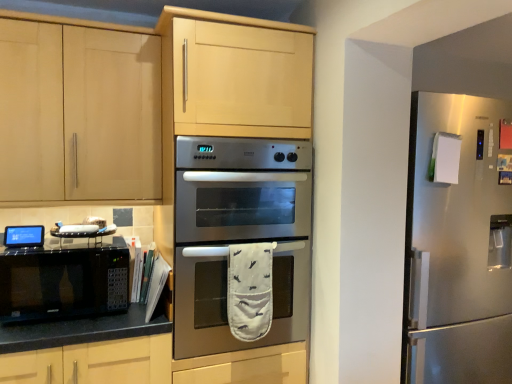
This screenshot has height=384, width=512. What do you see at coordinates (79, 113) in the screenshot?
I see `matte wood cabinet at upper left` at bounding box center [79, 113].

What is the approximate width of black matte microwave at left?

The width of black matte microwave at left is 2.90 inches.

Describe the element at coordinates (458, 242) in the screenshot. Image resolution: width=512 pixels, height=384 pixels. I see `satin silver refrigerator at right` at that location.

Locate an element on the screen. The image size is (512, 384). matte wood cabinet at upper left is located at coordinates (79, 113).

Are black matte microwave at left and matte wood cabinet at upper left located far from each other?

They are positioned close to each other.

In order to click on cabinetry above the black matte microwave at left (from a real-world perspective) in this screenshot , I will do `click(79, 113)`.

From the image's perspective, which is below, black matte microwave at left or matte wood cabinet at upper left?

black matte microwave at left appears lower in the image.

How far apart are black matte microwave at lower left and stainless steel oven at center?

black matte microwave at lower left and stainless steel oven at center are 20.23 inches apart.

Is stainless steel oven at center a part of black matte microwave at lower left?

No, stainless steel oven at center is located outside of black matte microwave at lower left.

How different are the orientations of black matte microwave at lower left and stainless steel oven at center in degrees?

The angle between the facing direction of black matte microwave at lower left and the facing direction of stainless steel oven at center is 0.305 degrees.

Would you say black matte microwave at lower left is to the left or to the right of stainless steel oven at center in the picture?

In the image, black matte microwave at lower left appears on the left side of stainless steel oven at center.

Considering the relative sizes of black matte microwave at left and stainless steel oven at center in the image provided, is black matte microwave at left bigger than stainless steel oven at center?

No, black matte microwave at left is not bigger than stainless steel oven at center.

Which is further, (24,245) or (280,281)?

Positioned behind is point (280,281).

Does black matte microwave at left appear on the left side of stainless steel oven at center?

Yes.

Who is shorter, black matte microwave at left or stainless steel oven at center?

black matte microwave at left is shorter.

From a real-world perspective, between black matte microwave at lower left and matte wood cabinet at upper left, who is vertically higher?

From a 3D spatial view, matte wood cabinet at upper left is above.

Based on the photo, is black matte microwave at lower left looking in the opposite direction of matte wood cabinet at upper left?

No, matte wood cabinet at upper left is not at the back of black matte microwave at lower left.

Which object is positioned more to the left, black matte microwave at lower left or matte wood cabinet at upper left?

From the viewer's perspective, matte wood cabinet at upper left appears more on the left side.

Does point (24, 304) come farther from viewer compared to point (118, 154)?

No, it is in front of (118, 154).

Identify the location of refrigerator beneath the black matte microwave at left (from a real-world perspective). Image resolution: width=512 pixels, height=384 pixels. (458, 242).

Is satin silver refrigerator at right placed right next to black matte microwave at left?

No, satin silver refrigerator at right is not in contact with black matte microwave at left.

Considering the relative sizes of satin silver refrigerator at right and black matte microwave at left in the image provided, is satin silver refrigerator at right wider than black matte microwave at left?

Indeed, satin silver refrigerator at right has a greater width compared to black matte microwave at left.

Is satin silver refrigerator at right located outside black matte microwave at left?

Yes, satin silver refrigerator at right is located beyond the bounds of black matte microwave at left.

Which is more distant, (148,158) or (36,240)?

Positioned behind is point (148,158).

Considering the relative sizes of matte wood cabinet at upper left and black matte microwave at left in the image provided, is matte wood cabinet at upper left thinner than black matte microwave at left?

No.

Is matte wood cabinet at upper left taller or shorter than black matte microwave at left?

In the image, matte wood cabinet at upper left appears to be taller than black matte microwave at left.

Is matte wood cabinet at upper left further to the viewer compared to black matte microwave at left?

That is False.

In terms of size, does matte wood cabinet at upper left appear bigger or smaller than black matte microwave at lower left?

Considering their sizes, matte wood cabinet at upper left takes up more space than black matte microwave at lower left.

Considering the positions of points (110, 136) and (92, 269), is point (110, 136) farther from camera compared to point (92, 269)?

Yes.

Is matte wood cabinet at upper left positioned with its back to black matte microwave at lower left?

No, matte wood cabinet at upper left is not facing away from black matte microwave at lower left.

Consider the image. Is matte wood cabinet at upper left wider or thinner than black matte microwave at lower left?

In the image, matte wood cabinet at upper left appears to be more narrow than black matte microwave at lower left.

Where is `appliance below the matte wood cabinet at upper left (from the image's perspective)`? Image resolution: width=512 pixels, height=384 pixels. appliance below the matte wood cabinet at upper left (from the image's perspective) is located at coordinates (24, 236).

At what (x,y) coordinates should I click in order to perform the action: click on microwave oven below the stainless steel oven at center (from a real-world perspective). Please return your answer as a coordinate pair (x, y). Looking at the image, I should click on (63, 282).

Which object lies further to the anchor point black matte microwave at lower left, satin silver refrigerator at right or stainless steel oven at center?

Among the two, satin silver refrigerator at right is located further to black matte microwave at lower left.

When comparing their distances from satin silver refrigerator at right, does black matte microwave at left or stainless steel oven at center seem closer?

stainless steel oven at center.

When comparing their distances from black matte microwave at lower left, does satin silver refrigerator at right or black matte microwave at left seem closer?

black matte microwave at left is positioned closer to the anchor black matte microwave at lower left.

Based on the photo, which object lies nearer to the anchor point black matte microwave at left, matte wood cabinet at upper left or stainless steel oven at center?

Among the two, matte wood cabinet at upper left is located nearer to black matte microwave at left.

Which object lies nearer to the anchor point stainless steel oven at center, satin silver refrigerator at right or matte wood cabinet at upper left?

The object closer to stainless steel oven at center is matte wood cabinet at upper left.

When comparing their distances from satin silver refrigerator at right, does stainless steel oven at center or matte wood cabinet at upper left seem closer?

stainless steel oven at center is closer to satin silver refrigerator at right.

Considering their positions, is black matte microwave at left positioned further to satin silver refrigerator at right than black matte microwave at lower left?

Among the two, black matte microwave at left is located further to satin silver refrigerator at right.

Consider the image. Based on their spatial positions, is stainless steel oven at center or satin silver refrigerator at right closer to black matte microwave at lower left?

stainless steel oven at center lies closer to black matte microwave at lower left than the other object.

What are the coordinates of `microwave oven between black matte microwave at left and satin silver refrigerator at right in the horizontal direction` in the screenshot? It's located at (63, 282).

At what (x,y) coordinates should I click in order to perform the action: click on microwave oven between matte wood cabinet at upper left and satin silver refrigerator at right. Please return your answer as a coordinate pair (x, y). The height and width of the screenshot is (384, 512). Looking at the image, I should click on (63, 282).

Image resolution: width=512 pixels, height=384 pixels. Find the location of `oven situated between matte wood cabinet at upper left and satin silver refrigerator at right from left to right`. oven situated between matte wood cabinet at upper left and satin silver refrigerator at right from left to right is located at coordinates (239, 235).

The width and height of the screenshot is (512, 384). What are the coordinates of `oven between black matte microwave at lower left and satin silver refrigerator at right` in the screenshot? It's located at (239, 235).